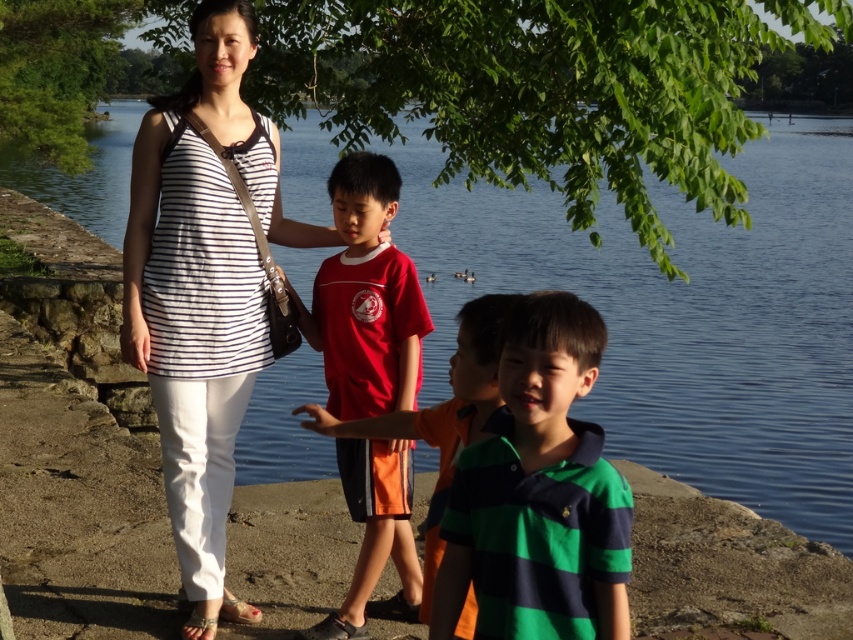
Looking at this image, you are standing at the edge of the concrete path near the three children. You want to walk to the blue water at center. Which direction should you walk relative to the white striped tank top at center?

You should walk to the left of the white striped tank top at center because the blue water at center is located to the left of it.

You are a photographer trying to capture a group photo of the blue water at center and the white striped tank top at center. If you want to ensure both are fully visible in the frame, which object should you prioritize framing first based on their widths?

The blue water at center has a greater width than the white striped tank top at center, so you should prioritize framing the blue water at center first to ensure it fits properly.